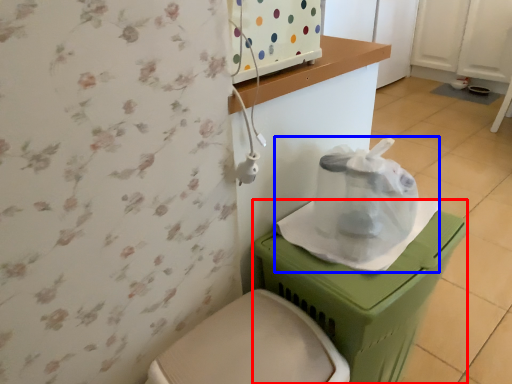
Question: Which object is closer to the camera taking this photo, potty (highlighted by a red box) or paper bag (highlighted by a blue box)?

Choices:
 (A) potty
 (B) paper bag

Answer: (A)